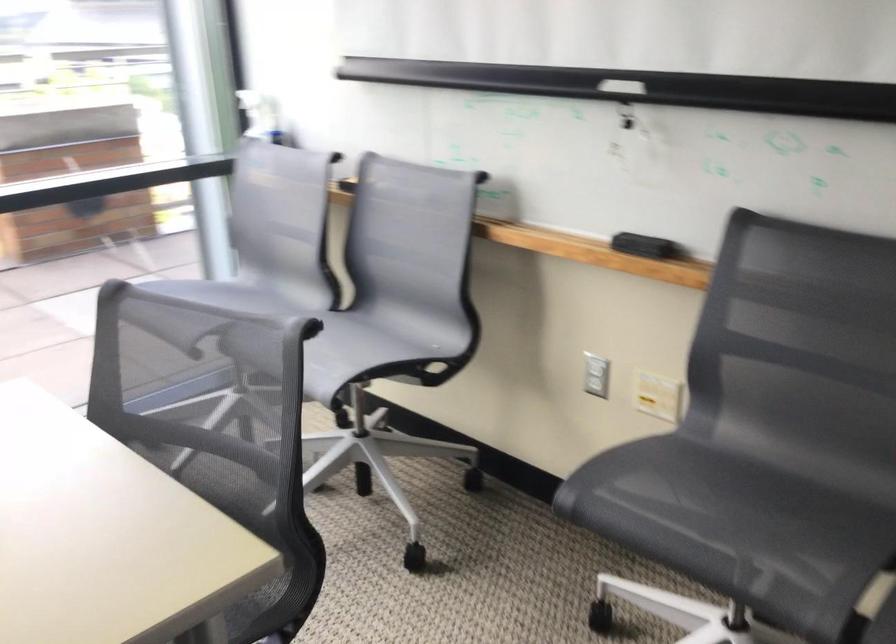
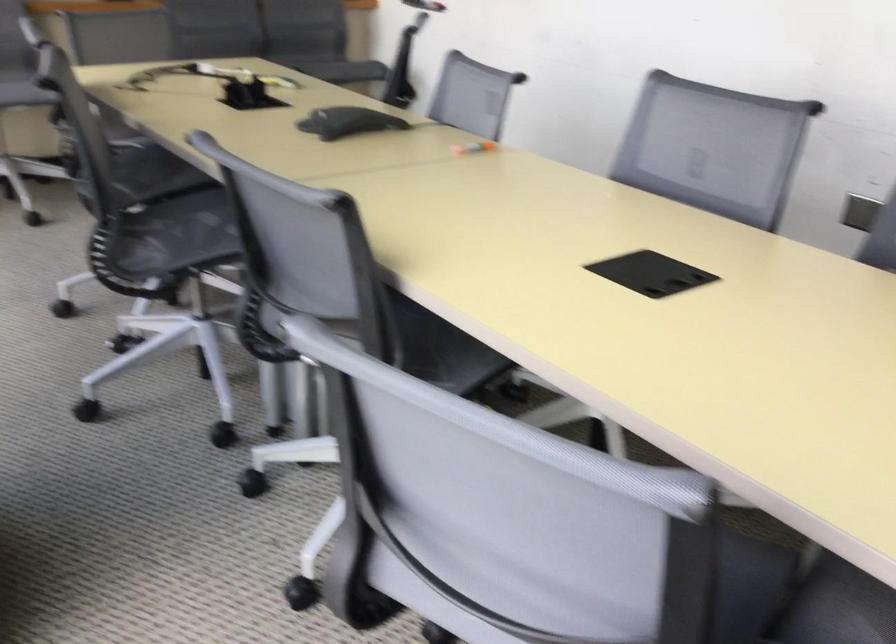
Question: I am providing you with two images of the same scene from different viewpoints. After the viewpoint changes to image2, which objects are now occluded?

Choices:
 (A) purple folded mat
 (B) orange marker
 (C) gray chair sitting surface
 (D) chair sitting surface

Answer: (C)